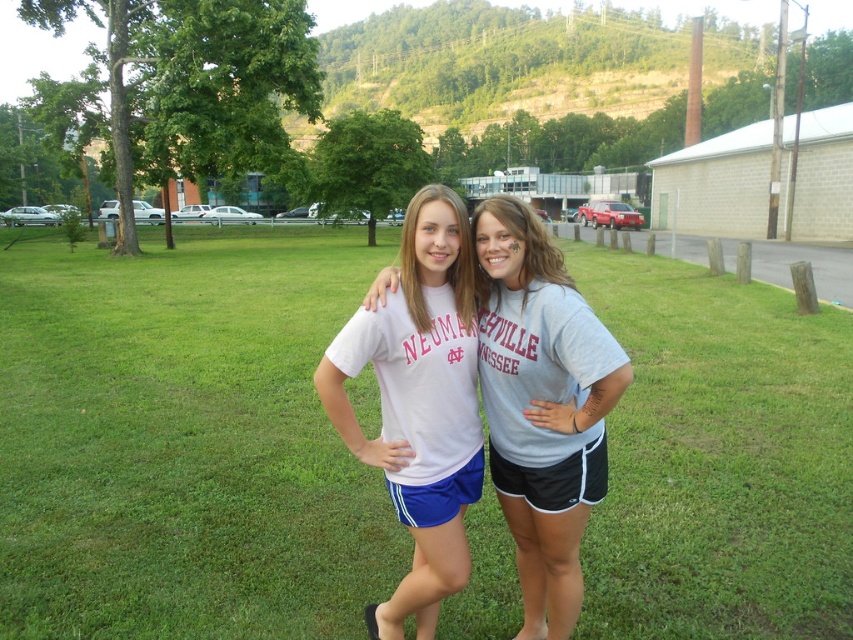
Between green grass at center and white matte t-shirt at center, which one is positioned lower?

Positioned lower is white matte t-shirt at center.

Who is more forward, (x=33, y=289) or (x=525, y=630)?

Point (x=525, y=630) is more forward.

Where is `green grass at center`? The image size is (853, 640). green grass at center is located at coordinates (183, 440).

In the scene shown: Who is higher up, white matte t-shirt at center or white matte shorts at center?

Positioned higher is white matte shorts at center.

What do you see at coordinates (543, 406) in the screenshot? I see `white matte t-shirt at center` at bounding box center [543, 406].

The height and width of the screenshot is (640, 853). Describe the element at coordinates (543, 406) in the screenshot. I see `white matte t-shirt at center` at that location.

Locate an element on the screen. This screenshot has width=853, height=640. white matte t-shirt at center is located at coordinates (543, 406).

Is point (204, 636) farther from camera compared to point (363, 330)?

Yes, point (204, 636) is behind point (363, 330).

Who is more forward, (x=99, y=412) or (x=426, y=317)?

Positioned in front is point (x=426, y=317).

The image size is (853, 640). What are the coordinates of `green grass at center` in the screenshot? It's located at [183, 440].